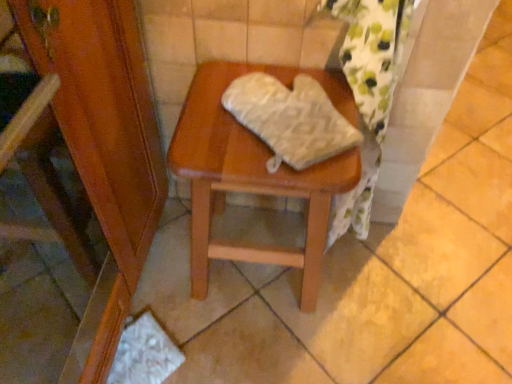
I want to click on white textured oven mitt at center, so click(x=290, y=119).

The width and height of the screenshot is (512, 384). What do you see at coordinates (290, 119) in the screenshot?
I see `white textured oven mitt at center` at bounding box center [290, 119].

I want to click on wooden stool at center, so click(254, 173).

In order to face wooden stool at center, should I rotate leftwards or rightwards?

You should look right and rotate roughly 1.453 degrees.

Image resolution: width=512 pixels, height=384 pixels. What do you see at coordinates (254, 173) in the screenshot?
I see `wooden stool at center` at bounding box center [254, 173].

Where is `white textured oven mitt at center`? white textured oven mitt at center is located at coordinates (290, 119).

Is white textured oven mitt at center to the left or to the right of wooden stool at center in the image?

white textured oven mitt at center is to the right of wooden stool at center.

Between white textured oven mitt at center and wooden stool at center, which one is positioned behind?

wooden stool at center.

Considering the points (323, 131) and (195, 165), which point is in front, point (323, 131) or point (195, 165)?

The point (195, 165) is closer to the camera.

From the image's perspective, relative to wooden stool at center, is white textured oven mitt at center above or below?

From the image's perspective, white textured oven mitt at center appears above wooden stool at center.

From a real-world perspective, is white textured oven mitt at center beneath wooden stool at center?

No, from a real-world perspective, white textured oven mitt at center is not below wooden stool at center.

Considering the relative sizes of white textured oven mitt at center and wooden stool at center in the image provided, is white textured oven mitt at center thinner than wooden stool at center?

Indeed, white textured oven mitt at center has a lesser width compared to wooden stool at center.

Which of these two, white textured oven mitt at center or wooden stool at center, stands shorter?

white textured oven mitt at center is shorter.

Considering the sizes of objects white textured oven mitt at center and wooden stool at center in the image provided, who is bigger, white textured oven mitt at center or wooden stool at center?

With larger size is wooden stool at center.

Based on the photo, choose the correct answer: Is white textured oven mitt at center inside wooden stool at center or outside it?

The correct answer is: outside.

Are white textured oven mitt at center and wooden stool at center far apart?

No, there isn't a large distance between white textured oven mitt at center and wooden stool at center.

Is white textured oven mitt at center turned away from wooden stool at center?

No, white textured oven mitt at center is not facing away from wooden stool at center.

Locate an element on the screen. The image size is (512, 384). stool that appears below the white textured oven mitt at center (from a real-world perspective) is located at coordinates (254, 173).

Can you confirm if wooden stool at center is positioned to the left of white textured oven mitt at center?

Indeed, wooden stool at center is positioned on the left side of white textured oven mitt at center.

Which is behind, wooden stool at center or white textured oven mitt at center?

wooden stool at center is more distant.

Which is nearer, (253, 157) or (266, 90)?

Clearly, point (253, 157) is closer to the camera than point (266, 90).

From the image's perspective, is wooden stool at center located above or below white textured oven mitt at center?

wooden stool at center is situated lower than white textured oven mitt at center in the image.

From a real-world perspective, is wooden stool at center physically above white textured oven mitt at center?

Actually, wooden stool at center is physically below white textured oven mitt at center in the real world.

Which of these two, wooden stool at center or white textured oven mitt at center, is thinner?

white textured oven mitt at center.

Does wooden stool at center have a greater height compared to white textured oven mitt at center?

Yes.

Between wooden stool at center and white textured oven mitt at center, which one has smaller size?

With smaller size is white textured oven mitt at center.

Would you say white textured oven mitt at center is part of wooden stool at center's contents?

No, white textured oven mitt at center is not inside wooden stool at center.

From the picture: Is wooden stool at center positioned far away from white textured oven mitt at center?

They are positioned close to each other.

Based on the photo, could you tell me if wooden stool at center is turned towards white textured oven mitt at center?

No, wooden stool at center is not facing towards white textured oven mitt at center.

What's the angular difference between wooden stool at center and white textured oven mitt at center's facing directions?

wooden stool at center and white textured oven mitt at center are facing 42.2 degrees away from each other.

Measure the distance from wooden stool at center to white textured oven mitt at center.

4.49 inches.

Where is `material on the right of wooden stool at center`? The width and height of the screenshot is (512, 384). material on the right of wooden stool at center is located at coordinates (290, 119).

The image size is (512, 384). What are the coordinates of `material on the right side of wooden stool at center` in the screenshot? It's located at (290, 119).

Find the location of a particular element. This screenshot has height=384, width=512. material above the wooden stool at center (from a real-world perspective) is located at coordinates (290, 119).